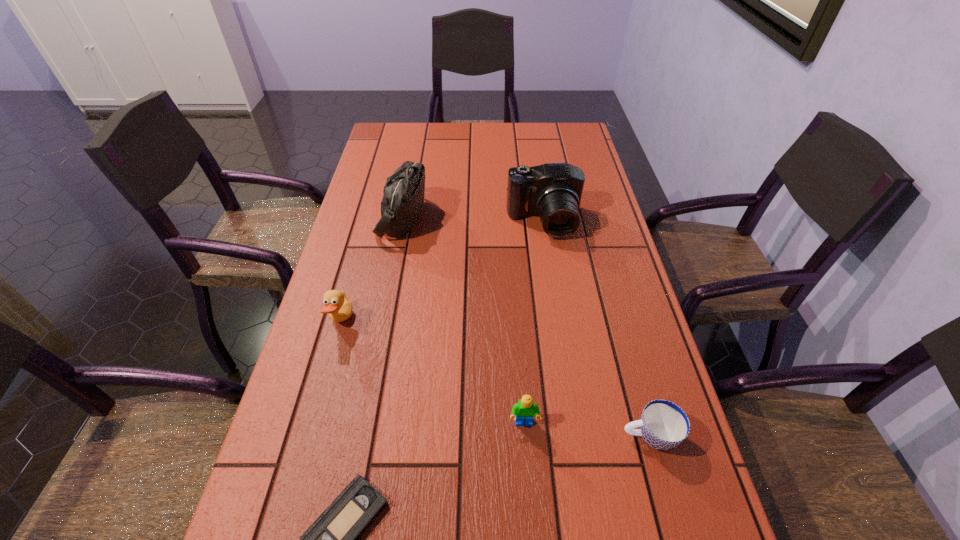
Identify the location of shoulder bag. (403, 199).

Locate an element on the screen. The height and width of the screenshot is (540, 960). camera is located at coordinates (553, 191).

The height and width of the screenshot is (540, 960). I want to click on duck, so click(339, 308).

Where is `Lego`? Lego is located at coordinates (524, 411).

You are a GUI agent. You are given a task and a screenshot of the screen. Output one action in this format:
    pyautogui.click(x=<x>, y=<y>)
    Task: Click on the second shortest object
    
    Given the screenshot: What is the action you would take?
    pyautogui.click(x=663, y=425)

At what (x,y) coordinates should I click in order to perform the action: click on blank area located 0.400m at the front padded panel of the shoulder bag. Please return your answer as a coordinate pair (x, y). The height and width of the screenshot is (540, 960). Looking at the image, I should click on (560, 218).

Find the location of a particular element. vacant space located on the lens of the second tallest object is located at coordinates (550, 261).

Identify the location of vacant area located 0.130m on the beak of the duck. The image size is (960, 540). (407, 321).

This screenshot has height=540, width=960. What are the coordinates of `vacant region located 0.100m on the face of the Lego` in the screenshot? It's located at point(528,483).

Identify the location of free point located 0.370m on the side of the second shortest object with the handle. (429, 436).